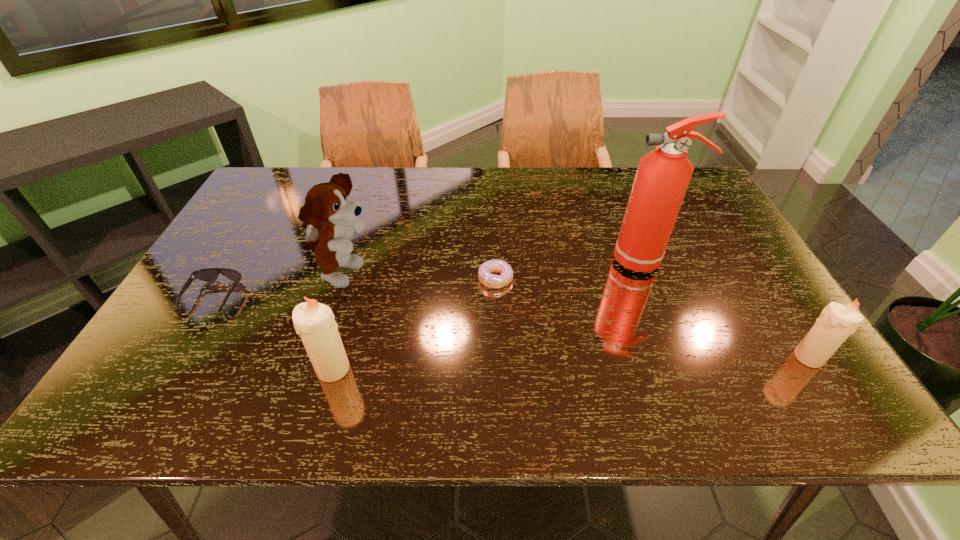
Please mark a free spot for a new candle to balance the arrangement. Please provide its 2D coordinates. Your answer should be formatted as a tuple, i.e. [(x, y)], where the tuple contains the x and y coordinates of a point satisfying the conditions above.

[(573, 363)]